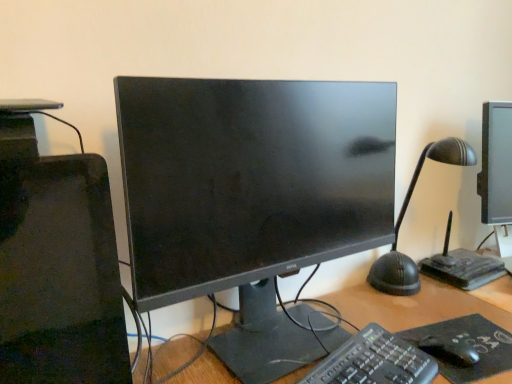
This screenshot has width=512, height=384. In order to click on spots to the right of black matte mouse at lower right in this screenshot , I will do `click(485, 343)`.